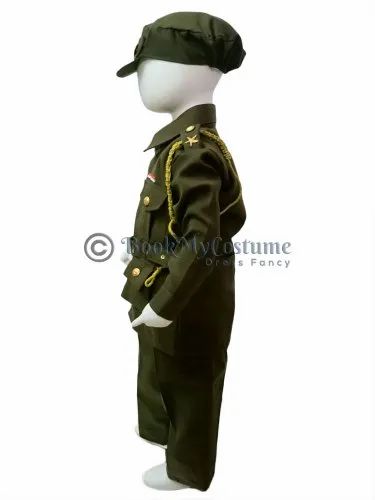
The height and width of the screenshot is (500, 375). In order to click on child-sized mannequin in this screenshot , I will do `click(165, 76)`.